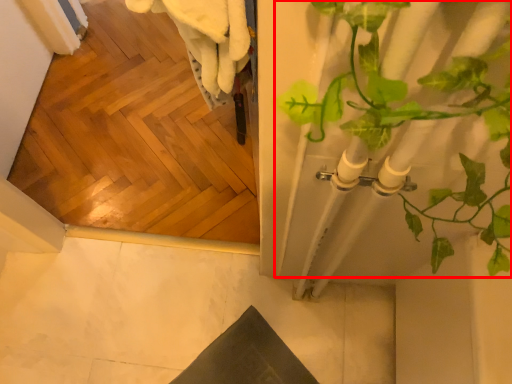
Question: From the image's perspective, where is houseplant (annotated by the red box) located relative to concrete?

Choices:
 (A) above
 (B) below

Answer: (A)